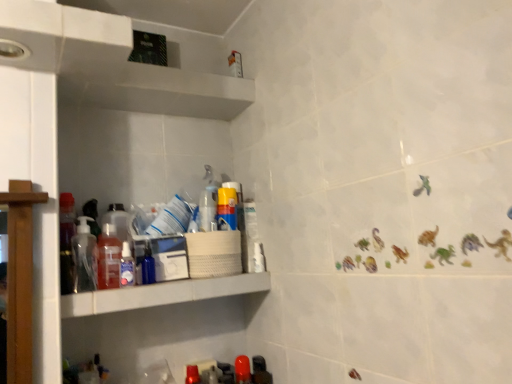
Question: Is glossy plastic bottle at lower center, the 7th bottle viewed from the left, bigger than translucent plastic soap dispenser at left, the eighth bottle from the right?

Choices:
 (A) no
 (B) yes

Answer: (A)

Question: From the image's perspective, is glossy plastic bottle at lower center, which is the second bottle in right-to-left order, below translucent plastic soap dispenser at left, the eighth bottle from the right?

Choices:
 (A) no
 (B) yes

Answer: (B)

Question: Does glossy plastic bottle at lower center, the 7th bottle viewed from the left, come behind translucent plastic soap dispenser at left, the eighth bottle from the right?

Choices:
 (A) yes
 (B) no

Answer: (A)

Question: Is glossy plastic bottle at lower center, which is the second bottle in right-to-left order, positioned with its back to translucent plastic soap dispenser at left, the eighth bottle from the right?

Choices:
 (A) yes
 (B) no

Answer: (B)

Question: Can you confirm if glossy plastic bottle at lower center, the 7th bottle viewed from the left, is wider than translucent plastic soap dispenser at left, the eighth bottle from the right?

Choices:
 (A) no
 (B) yes

Answer: (A)

Question: From a real-world perspective, is translucent plastic soap dispenser at left, the first bottle from the left, physically located above or below matte black bottle at lower center, the first bottle when ordered from right to left?

Choices:
 (A) below
 (B) above

Answer: (B)

Question: Visually, is translucent plastic soap dispenser at left, the eighth bottle from the right, positioned to the left or to the right of matte black bottle at lower center, the first bottle when ordered from right to left?

Choices:
 (A) right
 (B) left

Answer: (B)

Question: Is translucent plastic soap dispenser at left, the eighth bottle from the right, in front of or behind matte black bottle at lower center, placed as the eighth bottle when sorted from left to right, in the image?

Choices:
 (A) front
 (B) behind

Answer: (A)

Question: Considering the positions of translucent plastic soap dispenser at left, the first bottle from the left, and matte black bottle at lower center, placed as the eighth bottle when sorted from left to right, in the image, is translucent plastic soap dispenser at left, the first bottle from the left, taller or shorter than matte black bottle at lower center, placed as the eighth bottle when sorted from left to right,?

Choices:
 (A) tall
 (B) short

Answer: (A)

Question: Based on their positions, is transparent plastic spray bottle at center, which is counted as the 3th bottle, starting from the right, located to the left or right of translucent plastic bottle at shelf left, acting as the third bottle starting from the left?

Choices:
 (A) left
 (B) right

Answer: (B)

Question: From a real-world perspective, relative to translucent plastic bottle at shelf left, acting as the third bottle starting from the left, is transparent plastic spray bottle at center, which is counted as the 3th bottle, starting from the right, vertically above or below?

Choices:
 (A) above
 (B) below

Answer: (A)

Question: Considering the positions of point (202, 213) and point (111, 269), is point (202, 213) closer or farther from the camera than point (111, 269)?

Choices:
 (A) closer
 (B) farther

Answer: (B)

Question: From their relative heights in the image, would you say transparent plastic spray bottle at center, the sixth bottle in the left-to-right sequence, is taller or shorter than translucent plastic bottle at shelf left, acting as the third bottle starting from the left?

Choices:
 (A) tall
 (B) short

Answer: (B)

Question: In terms of height, does translucent plastic bottle at shelf left, which ranks as the seventh bottle in right-to-left order, look taller or shorter compared to matte black bottle at lower center, the first bottle when ordered from right to left?

Choices:
 (A) short
 (B) tall

Answer: (B)

Question: Considering the positions of translucent plastic bottle at shelf left, which ranks as the seventh bottle in right-to-left order, and matte black bottle at lower center, placed as the eighth bottle when sorted from left to right, in the image, is translucent plastic bottle at shelf left, which ranks as the seventh bottle in right-to-left order, bigger or smaller than matte black bottle at lower center, placed as the eighth bottle when sorted from left to right,?

Choices:
 (A) big
 (B) small

Answer: (A)